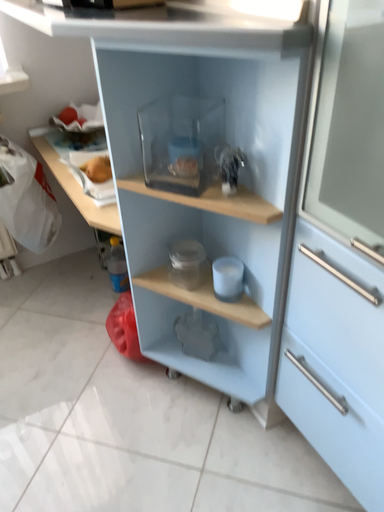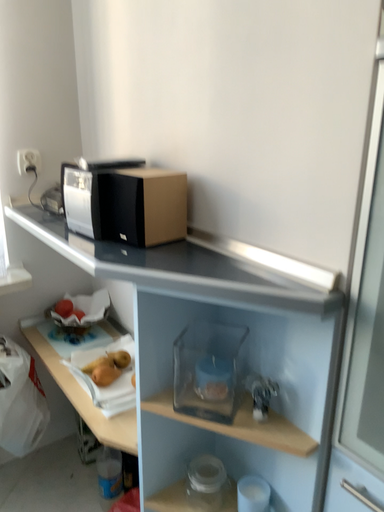
Question: Which way did the camera rotate in the video?

Choices:
 (A) rotated left
 (B) rotated right

Answer: (B)